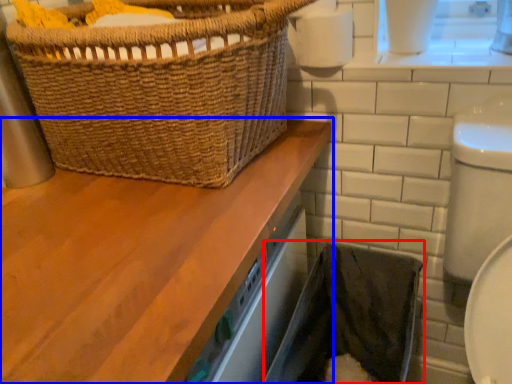
Question: Which of the following is the closest to the observer, laundry basket (highlighted by a red box) or bathroom cabinet (highlighted by a blue box)?

Choices:
 (A) laundry basket
 (B) bathroom cabinet

Answer: (B)